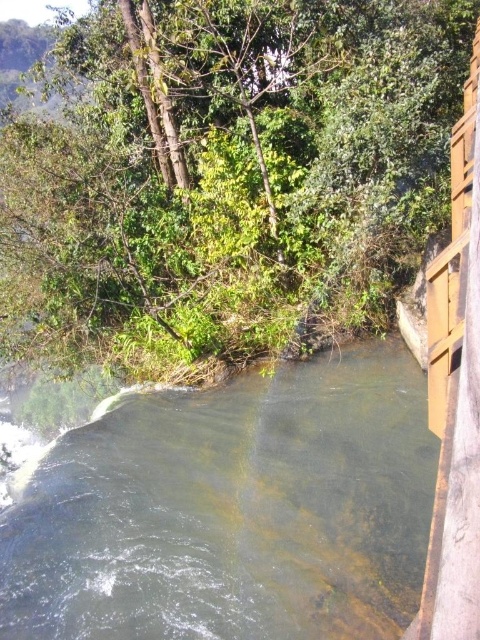
Question: Which object is farther from the camera taking this photo?

Choices:
 (A) green leafy tree at upper left
 (B) clear water at center

Answer: (A)

Question: Does green leafy tree at upper left appear on the left side of clear water at center?

Choices:
 (A) no
 (B) yes

Answer: (B)

Question: Among these points, which one is farthest from the camera?

Choices:
 (A) coord(226,444)
 (B) coord(384,225)

Answer: (B)

Question: Is green leafy tree at upper left thinner than clear water at center?

Choices:
 (A) no
 (B) yes

Answer: (A)

Question: Which point appears closest to the camera in this image?

Choices:
 (A) (33, 573)
 (B) (171, 202)

Answer: (A)

Question: Does green leafy tree at upper left appear over clear water at center?

Choices:
 (A) no
 (B) yes

Answer: (B)